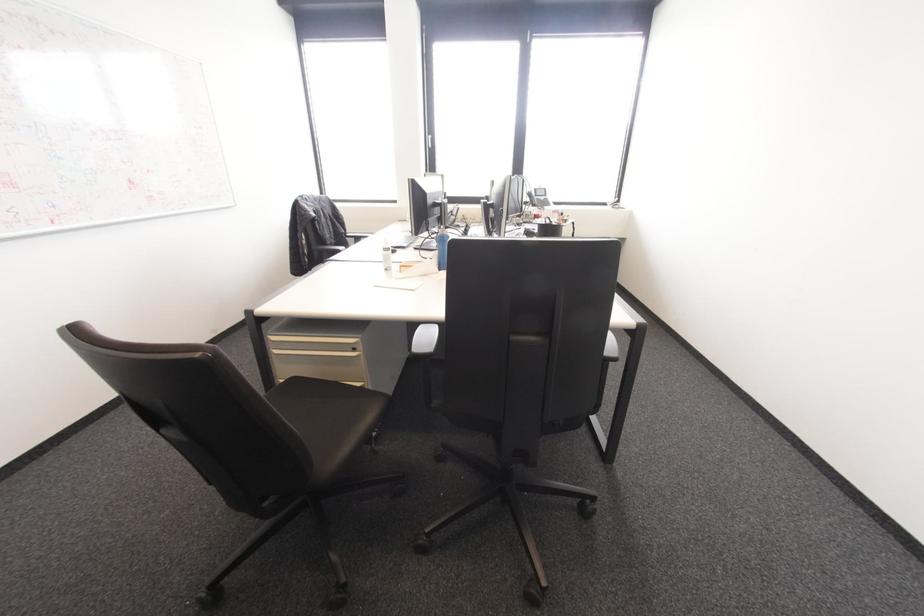
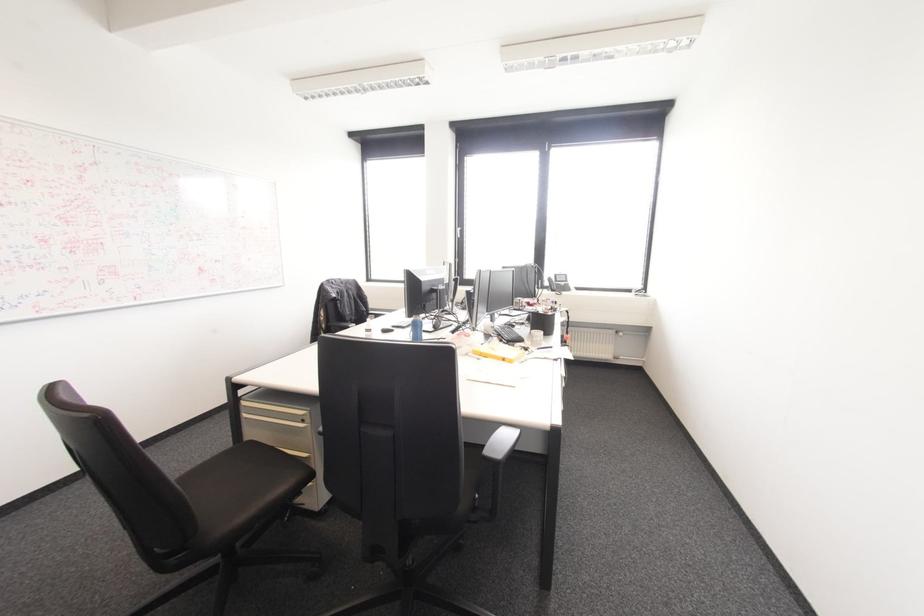
In the second image, find the point that corresponds to [354,349] in the first image.

(302, 419)